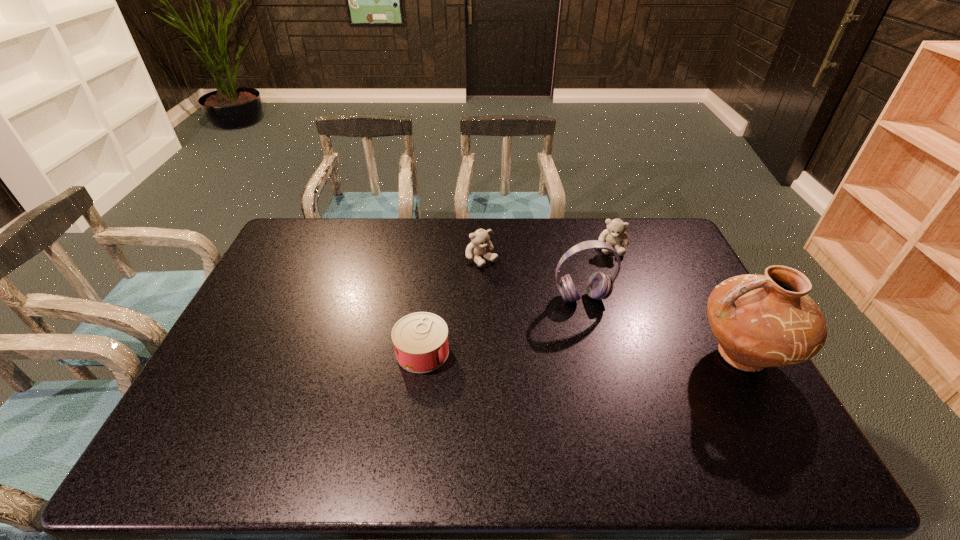
Locate an element on the screen. Image resolution: width=960 pixels, height=540 pixels. vacant space on the desktop that is between the can and the tallest object and is positioned on the face of the left teddy bear is located at coordinates (570, 354).

The image size is (960, 540). What are the coordinates of `free space on the desktop that is between the can and the tallest object and is positioned on the face of the fourth object from left to right` in the screenshot? It's located at (611, 354).

The image size is (960, 540). Identify the location of free spot on the desktop that is between the shortest object and the pottery and is positioned on the headband and ear cups of the fourth shortest object. (607, 354).